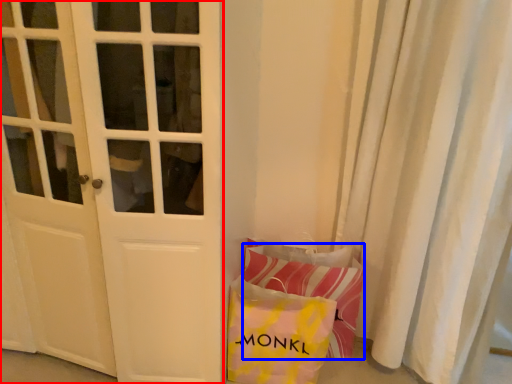
Question: Which object appears closest to the camera in this image, door (highlighted by a red box) or pillow (highlighted by a blue box)?

Choices:
 (A) door
 (B) pillow

Answer: (A)